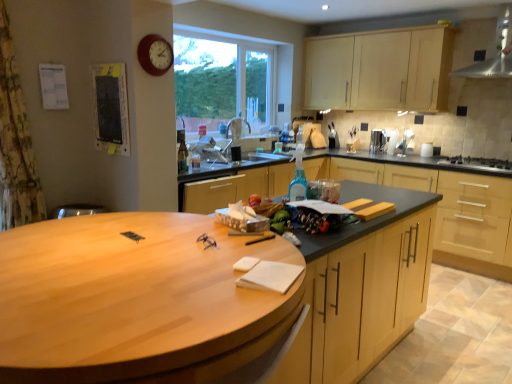
Question: Is matte black bulletin board at upper left at the back of matte wood cabinets at center, the 2th cabinetry in the top-to-bottom sequence?

Choices:
 (A) yes
 (B) no

Answer: (B)

Question: Can you confirm if matte wood cabinets at center, the 1th cabinetry from the bottom, is bigger than matte black bulletin board at upper left?

Choices:
 (A) yes
 (B) no

Answer: (A)

Question: Is matte wood cabinets at center, the 2th cabinetry in the top-to-bottom sequence, far away from matte black bulletin board at upper left?

Choices:
 (A) yes
 (B) no

Answer: (A)

Question: Considering the relative sizes of matte wood cabinets at center, the 2th cabinetry in the top-to-bottom sequence, and matte black bulletin board at upper left in the image provided, is matte wood cabinets at center, the 2th cabinetry in the top-to-bottom sequence, wider than matte black bulletin board at upper left?

Choices:
 (A) yes
 (B) no

Answer: (A)

Question: Is matte wood cabinets at center, the 2th cabinetry in the top-to-bottom sequence, further to the viewer compared to matte black bulletin board at upper left?

Choices:
 (A) yes
 (B) no

Answer: (A)

Question: In terms of size, does matte wood cabinets at center, the 1th cabinetry from the bottom, appear bigger or smaller than black matte sink at center?

Choices:
 (A) big
 (B) small

Answer: (A)

Question: From a real-world perspective, is matte wood cabinets at center, the 2th cabinetry in the top-to-bottom sequence, above or below black matte sink at center?

Choices:
 (A) above
 (B) below

Answer: (B)

Question: Looking at their shapes, would you say matte wood cabinets at center, the 2th cabinetry in the top-to-bottom sequence, is wider or thinner than black matte sink at center?

Choices:
 (A) wide
 (B) thin

Answer: (A)

Question: Is matte wood cabinets at center, the 2th cabinetry in the top-to-bottom sequence, in front of or behind black matte sink at center in the image?

Choices:
 (A) behind
 (B) front

Answer: (B)

Question: From their relative heights in the image, would you say matte wood cabinets at center, the 2th cabinetry in the top-to-bottom sequence, is taller or shorter than wooden at center?

Choices:
 (A) short
 (B) tall

Answer: (A)

Question: Is point (403, 177) closer or farther from the camera than point (110, 336)?

Choices:
 (A) closer
 (B) farther

Answer: (B)

Question: Is matte wood cabinets at center, the 1th cabinetry from the bottom, inside the boundaries of wooden at center, or outside?

Choices:
 (A) outside
 (B) inside

Answer: (A)

Question: From a real-world perspective, relative to wooden at center, is matte wood cabinets at center, the 1th cabinetry from the bottom, vertically above or below?

Choices:
 (A) below
 (B) above

Answer: (A)

Question: Considering their positions, is satin silver kettle at upper right located in front of or behind wooden clock at upper left?

Choices:
 (A) front
 (B) behind

Answer: (B)

Question: Is satin silver kettle at upper right to the left or to the right of wooden clock at upper left in the image?

Choices:
 (A) left
 (B) right

Answer: (B)